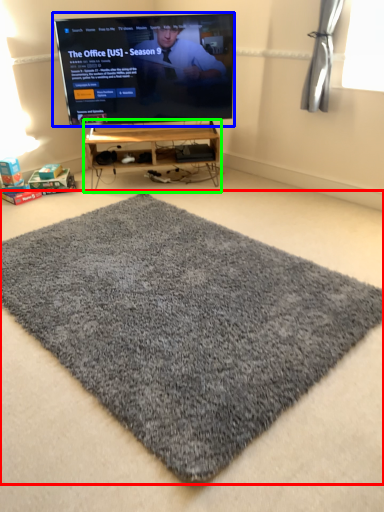
Question: Which is farther away from mat (highlighted by a red box)? television (highlighted by a blue box) or furniture (highlighted by a green box)?

Choices:
 (A) television
 (B) furniture

Answer: (A)